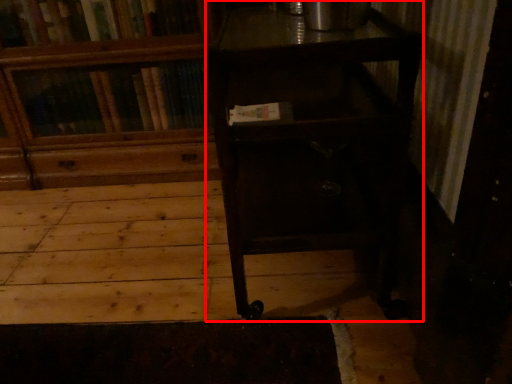
Question: From the image's perspective, considering the relative positions of table (annotated by the red box) and bookcase in the image provided, where is table (annotated by the red box) located with respect to the staircase?

Choices:
 (A) above
 (B) below

Answer: (B)